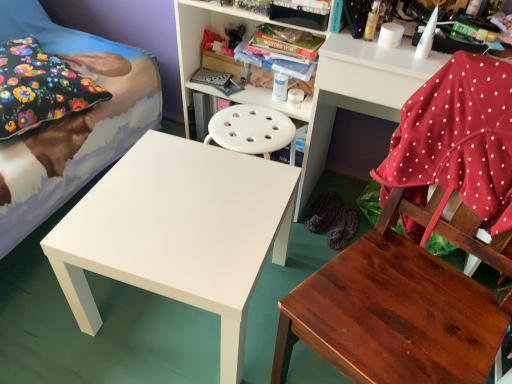
Question: Is white matte table at center behind white plastic shelf at upper right, which appears as the 2th shelf when viewed from the left?

Choices:
 (A) no
 (B) yes

Answer: (A)

Question: Does white matte table at center appear on the right side of white plastic shelf at upper right, which appears as the 2th shelf when viewed from the left?

Choices:
 (A) yes
 (B) no

Answer: (B)

Question: Is white matte table at center at the left side of white plastic shelf at upper right, which appears as the 2th shelf when viewed from the left?

Choices:
 (A) yes
 (B) no

Answer: (A)

Question: From a real-world perspective, is white matte table at center positioned over white plastic shelf at upper right, which appears as the 2th shelf when viewed from the left, based on gravity?

Choices:
 (A) no
 (B) yes

Answer: (A)

Question: Can we say white matte table at center lies outside white plastic shelf at upper right, which appears as the 2th shelf when viewed from the left?

Choices:
 (A) yes
 (B) no

Answer: (A)

Question: Is white matte table at center shorter than white plastic shelf at upper right, which appears as the 2th shelf when viewed from the left?

Choices:
 (A) yes
 (B) no

Answer: (A)

Question: Is white glossy bed at left bigger than floral fabric pillow at upper left?

Choices:
 (A) yes
 (B) no

Answer: (A)

Question: Does white glossy bed at left appear on the left side of floral fabric pillow at upper left?

Choices:
 (A) yes
 (B) no

Answer: (A)

Question: Can we say white glossy bed at left lies outside floral fabric pillow at upper left?

Choices:
 (A) no
 (B) yes

Answer: (B)

Question: From a real-world perspective, is white glossy bed at left over floral fabric pillow at upper left?

Choices:
 (A) yes
 (B) no

Answer: (A)

Question: Is the position of white glossy bed at left less distant than that of floral fabric pillow at upper left?

Choices:
 (A) no
 (B) yes

Answer: (B)

Question: Does white glossy bed at left touch floral fabric pillow at upper left?

Choices:
 (A) yes
 (B) no

Answer: (B)

Question: From the image's perspective, is wooden chair at lower right under floral fabric pillow at upper left?

Choices:
 (A) yes
 (B) no

Answer: (A)